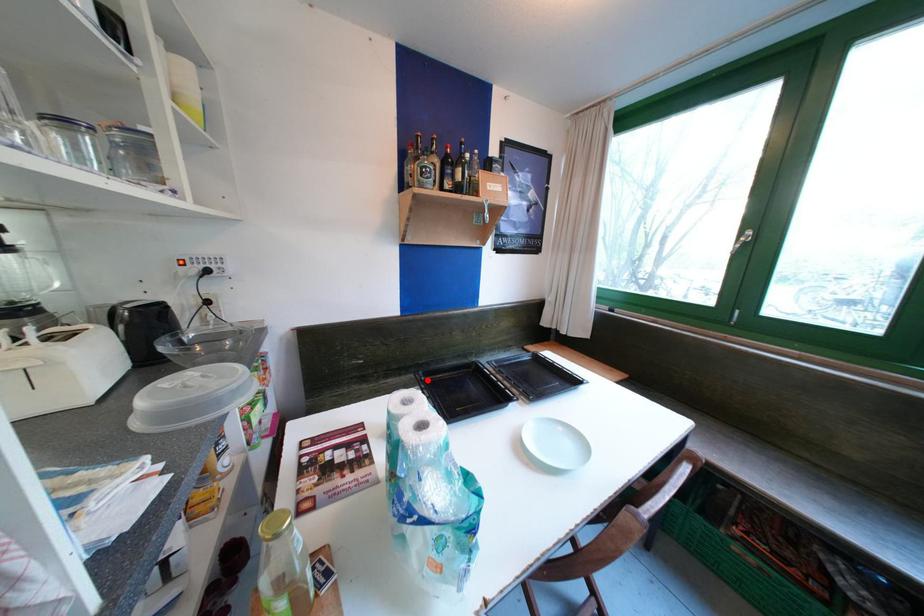
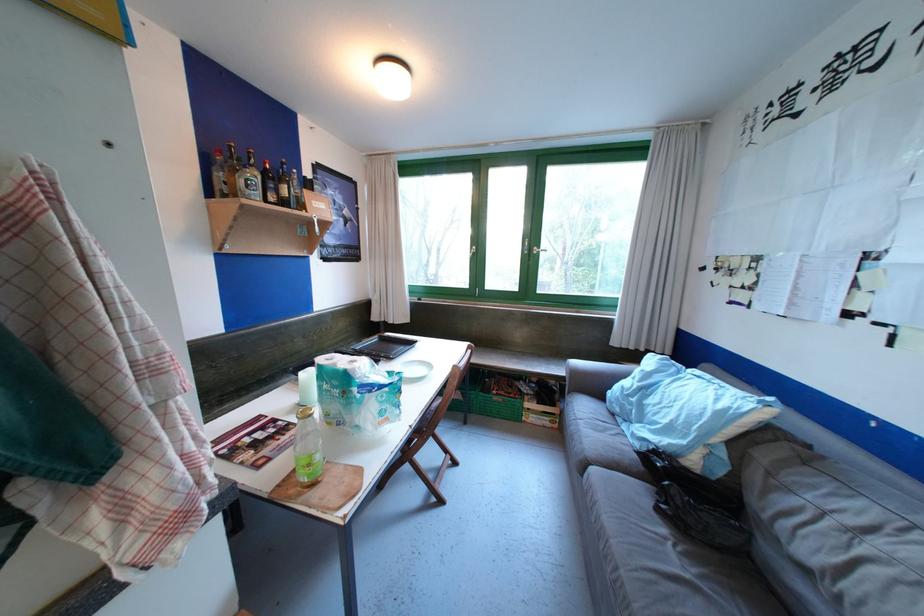
Question: I am providing you with two images of the same scene from different viewpoints. A red point is marked on the first image. At the location where the point appears in image 1, is it still visible in image 2?

Choices:
 (A) Yes
 (B) No

Answer: (B)